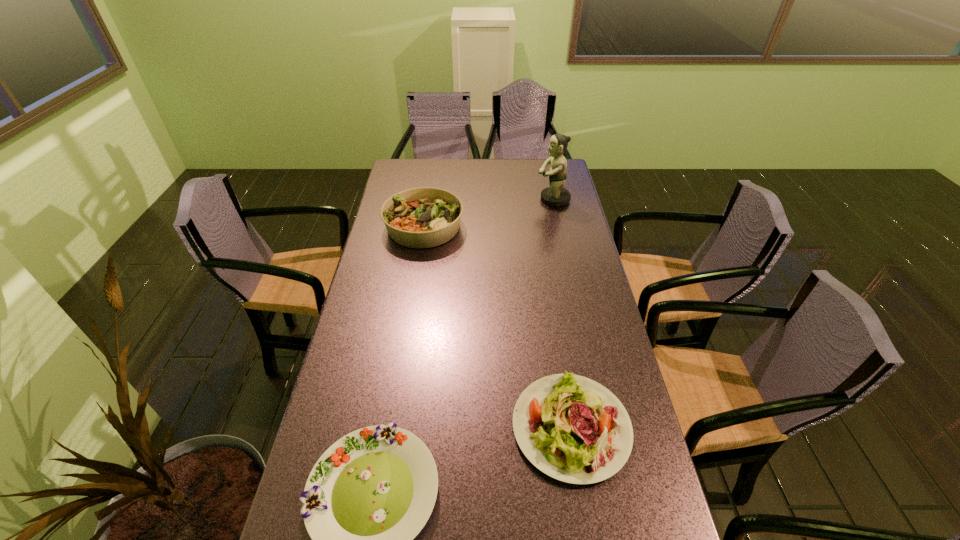
Image resolution: width=960 pixels, height=540 pixels. What are the coordinates of `figurine` in the screenshot? It's located at (555, 195).

The width and height of the screenshot is (960, 540). Find the location of `the farthest salad plate`. the farthest salad plate is located at coordinates (424, 217).

Find the location of a particular element. The height and width of the screenshot is (540, 960). the third shortest object is located at coordinates (424, 217).

Find the location of `the second shortest object`. the second shortest object is located at coordinates (572, 428).

Where is `the rightmost salad plate`? This screenshot has height=540, width=960. the rightmost salad plate is located at coordinates (572, 428).

Where is `free space located on the front-facing side of the figurine`? free space located on the front-facing side of the figurine is located at coordinates (477, 199).

Where is `vacant space located 0.200m on the front-facing side of the figurine`? vacant space located 0.200m on the front-facing side of the figurine is located at coordinates (489, 199).

Where is `free space located on the front-facing side of the figurine`? This screenshot has width=960, height=540. free space located on the front-facing side of the figurine is located at coordinates (515, 199).

Identify the location of blank space located 0.140m on the front of the farthest salad plate. (416, 278).

This screenshot has width=960, height=540. I want to click on vacant point located on the left of the third tallest object, so click(x=414, y=427).